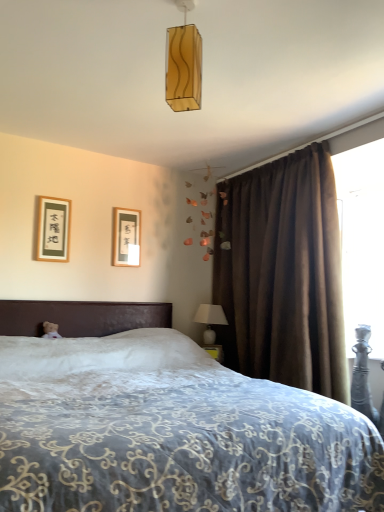
Question: Can you confirm if brown velvet curtain at right is wider than transparent plastic screen at upper right?

Choices:
 (A) yes
 (B) no

Answer: (A)

Question: Is the position of brown velvet curtain at right less distant than that of transparent plastic screen at upper right?

Choices:
 (A) no
 (B) yes

Answer: (B)

Question: Is brown velvet curtain at right further to the viewer compared to transparent plastic screen at upper right?

Choices:
 (A) no
 (B) yes

Answer: (A)

Question: Can you confirm if brown velvet curtain at right is smaller than transparent plastic screen at upper right?

Choices:
 (A) yes
 (B) no

Answer: (B)

Question: Can you confirm if brown velvet curtain at right is positioned to the left of transparent plastic screen at upper right?

Choices:
 (A) yes
 (B) no

Answer: (A)

Question: From the image's perspective, is brown velvet curtain at right located above transparent plastic screen at upper right?

Choices:
 (A) no
 (B) yes

Answer: (A)

Question: Is matte black picture frame at upper left, which is the first picture frame in front-to-back order, oriented away from brown velvet curtain at right?

Choices:
 (A) no
 (B) yes

Answer: (A)

Question: From the image's perspective, is matte black picture frame at upper left, which is counted as the second picture frame, starting from the right, above brown velvet curtain at right?

Choices:
 (A) no
 (B) yes

Answer: (B)

Question: Is matte black picture frame at upper left, which is counted as the 2th picture frame, starting from the back, at the right side of brown velvet curtain at right?

Choices:
 (A) no
 (B) yes

Answer: (A)

Question: Does matte black picture frame at upper left, which is counted as the 2th picture frame, starting from the back, have a greater height compared to brown velvet curtain at right?

Choices:
 (A) no
 (B) yes

Answer: (A)

Question: Can you confirm if matte black picture frame at upper left, which is counted as the second picture frame, starting from the right, is thinner than brown velvet curtain at right?

Choices:
 (A) no
 (B) yes

Answer: (B)

Question: Is matte black picture frame at upper left, which is counted as the second picture frame, starting from the right, directly adjacent to brown velvet curtain at right?

Choices:
 (A) yes
 (B) no

Answer: (B)

Question: Is white plush teddy bear at left at the right side of brown velvet curtain at right?

Choices:
 (A) yes
 (B) no

Answer: (B)